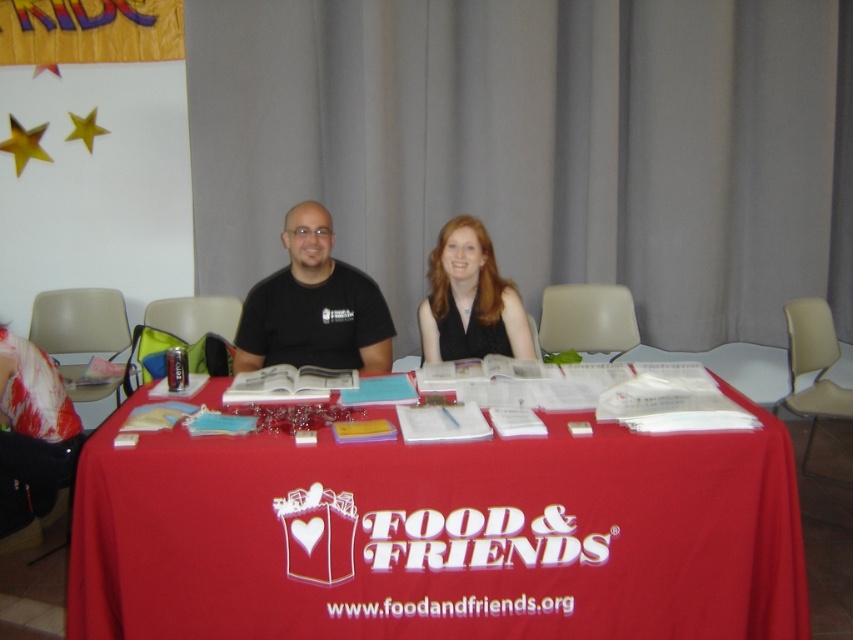
Question: Can you confirm if black matte t-shirt at center is thinner than matte black vest at center?

Choices:
 (A) yes
 (B) no

Answer: (B)

Question: Can you confirm if black matte t-shirt at center is positioned below matte black vest at center?

Choices:
 (A) yes
 (B) no

Answer: (A)

Question: Estimate the real-world distances between objects in this image. Which object is closer to the matte black vest at center?

Choices:
 (A) black matte t-shirt at center
 (B) red cloth table at center

Answer: (A)

Question: Which object is positioned farthest from the matte black vest at center?

Choices:
 (A) black matte t-shirt at center
 (B) red cloth table at center

Answer: (B)

Question: Is black matte t-shirt at center below matte black vest at center?

Choices:
 (A) yes
 (B) no

Answer: (A)

Question: Which point appears closest to the camera in this image?

Choices:
 (A) (465, 604)
 (B) (434, 264)
 (C) (296, 305)

Answer: (A)